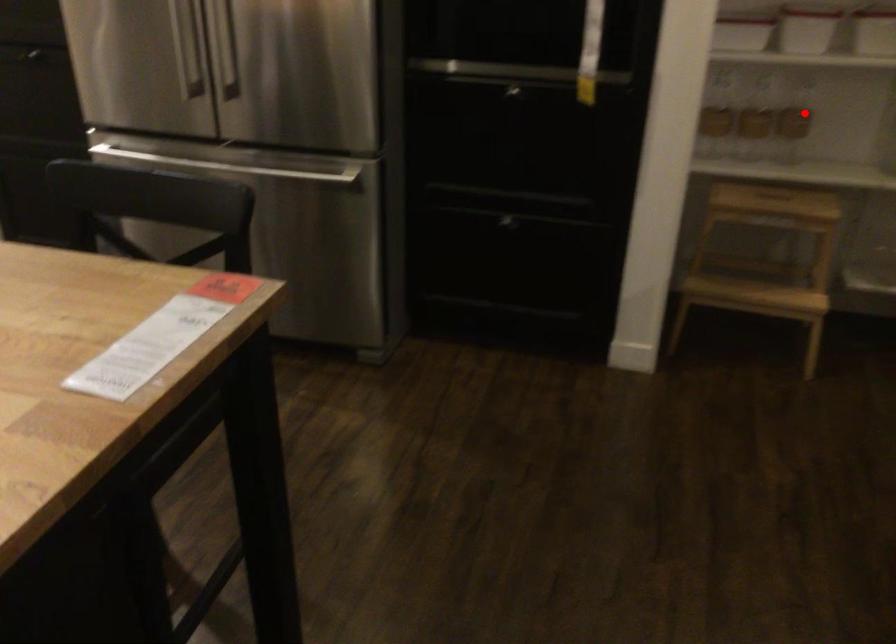
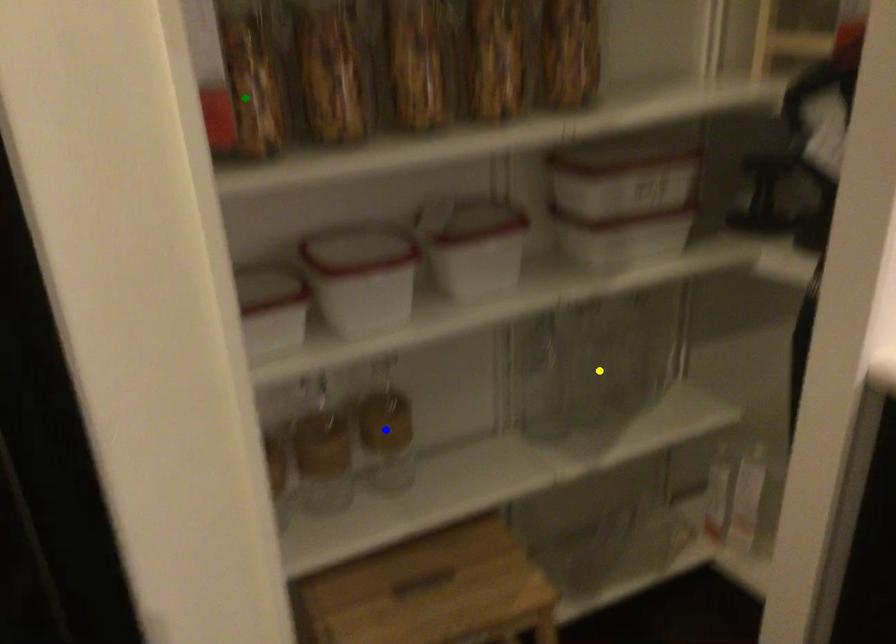
Question: I am providing you with two images of the same scene from different viewpoints. A red point is marked on the first image. You are given multiple points on the second image. Which spot in image 2 lines up with the point in image 1?

Choices:
 (A) green point
 (B) blue point
 (C) yellow point

Answer: (B)